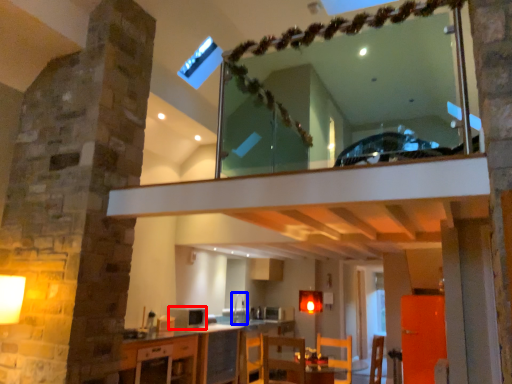
Question: Which object appears closest to the camera in this image, appliance (highlighted by a red box) or sink (highlighted by a blue box)?

Choices:
 (A) appliance
 (B) sink

Answer: (A)